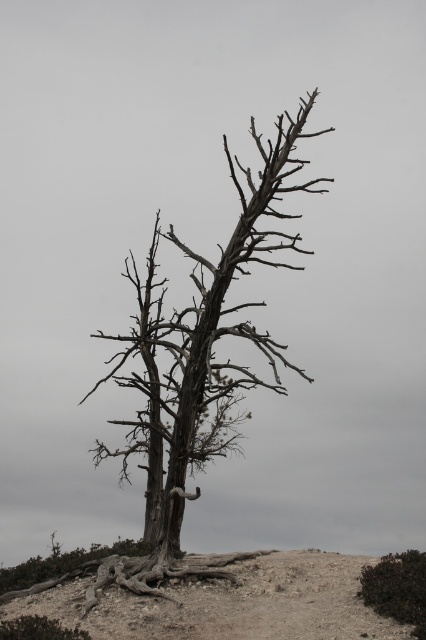
Looking at this image, you are standing at the center of the barren landscape and see the point labeled as point [204,337]. Based on the scene description, what object does this point most likely represent?

The point [204,337] corresponds to the gray bark tree at center.

You are a hiker who wants to take a photo of the gray bark tree at center and the brown sandy soil at lower center. Since you want both subjects to be clearly visible in the frame, which one should you focus on first to ensure proper focus?

The gray bark tree at center is larger in size than the brown sandy soil at lower center, so you should focus on the gray bark tree at center first to ensure proper focus since it occupies more of the frame.

You are a gardener trying to plant a new shrub between the gray bark tree at center and the brown sandy soil at lower center. What is the minimum distance you need to maintain between the shrub and each of these two objects?

The gray bark tree at center and brown sandy soil at lower center are 5.16 feet apart. To plant the shrub between them, you should maintain at least half the distance between them from each, so approximately 2.58 feet from each object.